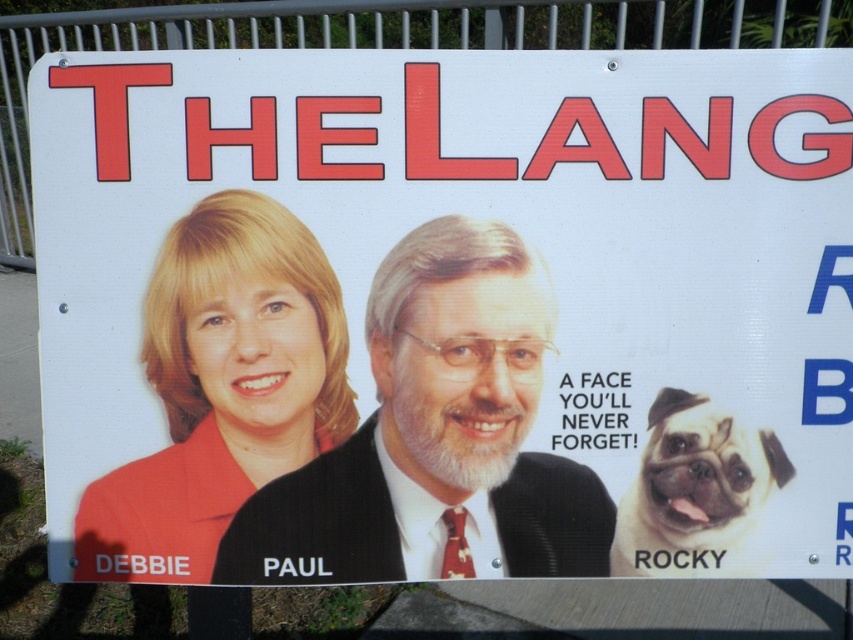
I want to click on matte black suit at center, so pos(436,438).

Is matte black suit at center positioned at the back of white fur dog at lower right?

No, it is not.

Is point (325, 557) more distant than point (630, 541)?

No.

I want to click on matte black suit at center, so click(x=436, y=438).